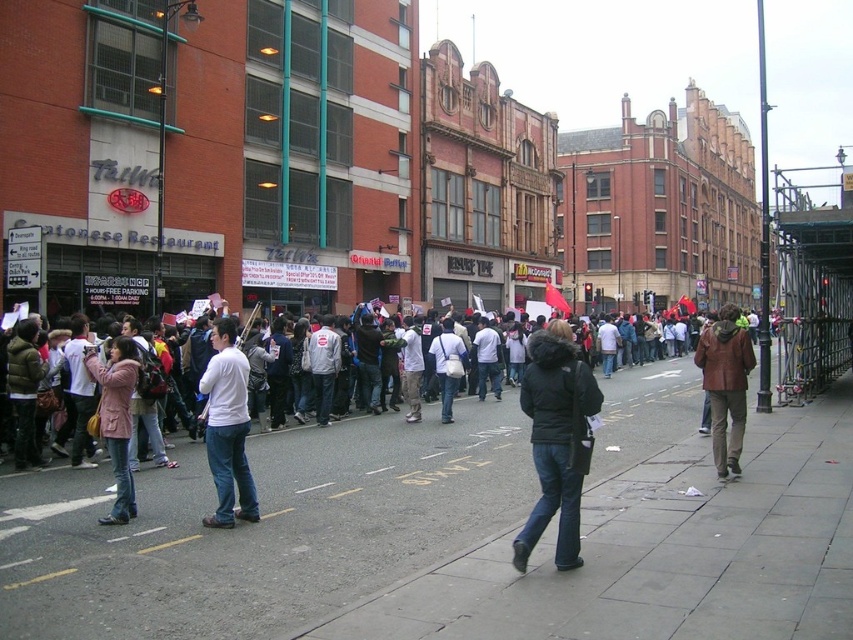
You are a delivery person trying to reach the white fabric bag at center from the gray concrete sidewalk at lower center. The sidewalk is 14.63 feet away. Your delivery cart is 2.5 feet wide. Is there enough space to move the cart from the sidewalk to the bag?

The gray concrete sidewalk at lower center is 14.63 feet away from the white fabric bag at center. Since the distance is sufficient and the width of the sidewalk isn